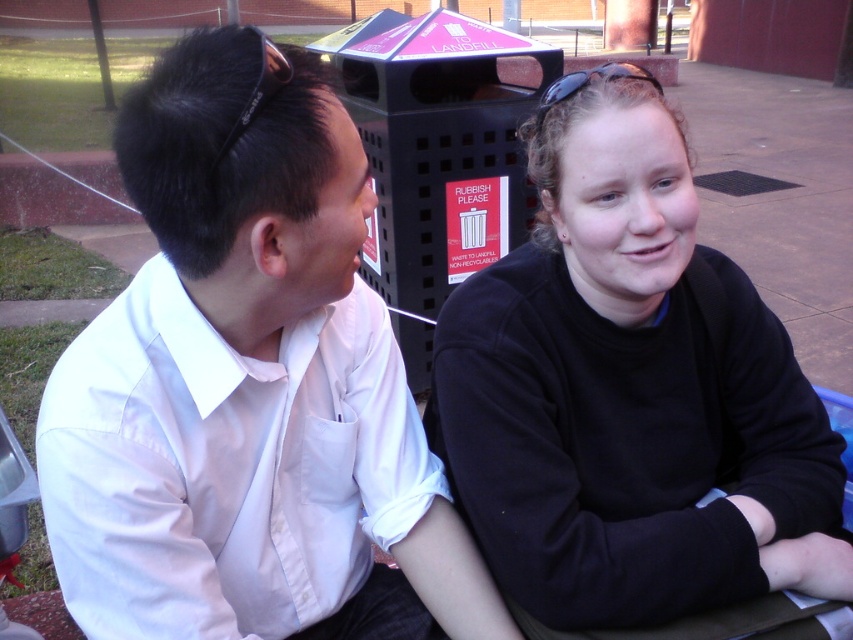
Between point (660, 374) and point (283, 570), which one is positioned behind?

The point (660, 374) is behind.

Is point (611, 605) closer to viewer compared to point (421, 486)?

Yes.

Between point (445, 440) and point (126, 556), which one is positioned behind?

The point (445, 440) is behind.

Where is `black matte sweater at center`? The image size is (853, 640). black matte sweater at center is located at coordinates (630, 392).